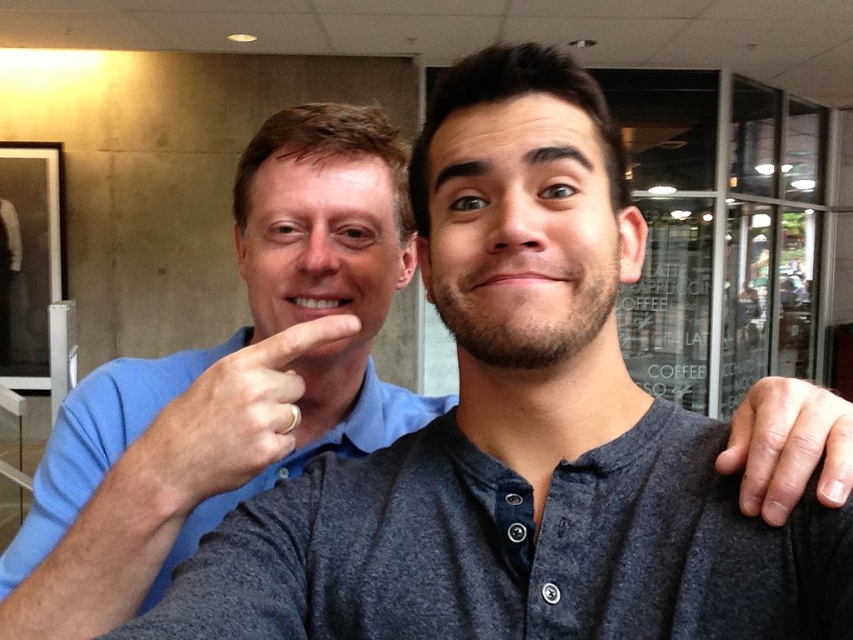
Between gold metallic ring at center and dry skin at right, which one has less height?

With less height is dry skin at right.

From the picture: Can you confirm if gold metallic ring at center is thinner than dry skin at right?

No, gold metallic ring at center is not thinner than dry skin at right.

Is point (292, 369) more distant than point (747, 499)?

That is True.

The image size is (853, 640). What are the coordinates of `gold metallic ring at center` in the screenshot? It's located at (229, 419).

Which is more to the right, blue cotton shirt at center or dry skin at right?

From the viewer's perspective, dry skin at right appears more on the right side.

Between point (19, 531) and point (821, 417), which one is positioned behind?

Positioned behind is point (19, 531).

Find the location of a particular element. The height and width of the screenshot is (640, 853). blue cotton shirt at center is located at coordinates point(97,442).

How far apart are blue cotton shirt at center and gold metallic ring at center?

blue cotton shirt at center is 6.26 inches from gold metallic ring at center.

Is blue cotton shirt at center wider than gold metallic ring at center?

Indeed, blue cotton shirt at center has a greater width compared to gold metallic ring at center.

Is point (235, 497) closer to viewer compared to point (152, 474)?

No, (235, 497) is behind (152, 474).

I want to click on blue cotton shirt at center, so click(x=97, y=442).